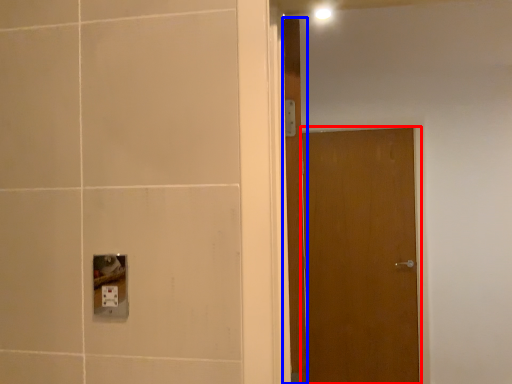
Question: Which point is closer to the camera, door (highlighted by a red box) or door (highlighted by a blue box)?

Choices:
 (A) door
 (B) door

Answer: (B)